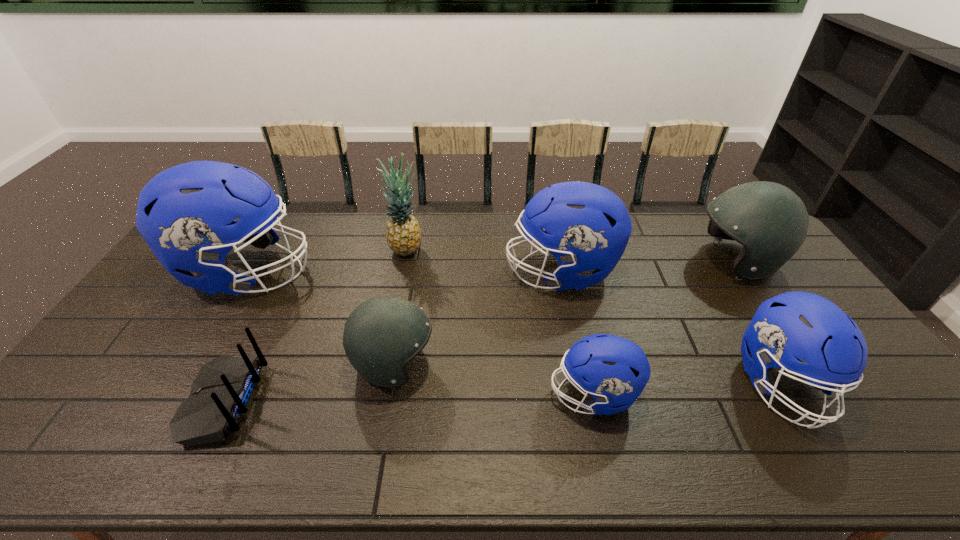
The image size is (960, 540). I want to click on vacant space situated 0.210m at the face opening of the smaller green football helmet, so coord(513,363).

The height and width of the screenshot is (540, 960). Find the location of `vacant space located 0.120m on the front-facing side of the smallest blue football helmet`. vacant space located 0.120m on the front-facing side of the smallest blue football helmet is located at coordinates (502, 394).

Where is `vacant area situated 0.220m on the front-facing side of the smallest blue football helmet`? vacant area situated 0.220m on the front-facing side of the smallest blue football helmet is located at coordinates (463, 394).

The width and height of the screenshot is (960, 540). In order to click on vacant space positioned on the front-facing side of the smallest blue football helmet in this screenshot , I will do `click(450, 394)`.

This screenshot has height=540, width=960. I want to click on free space located 0.310m on the back of the router, so click(x=381, y=401).

The image size is (960, 540). What are the coordinates of `pineapple that is at the far edge` in the screenshot? It's located at coord(403,234).

What are the coordinates of `football helmet present at the near edge` in the screenshot? It's located at (795, 325).

Find the location of a particular element. The height and width of the screenshot is (540, 960). router that is at the near edge is located at coordinates (221, 394).

At what (x,y) coordinates should I click in order to perform the action: click on object present at the left edge. Please return your answer as a coordinate pair (x, y). This screenshot has height=540, width=960. Looking at the image, I should click on (185, 214).

Locate an element on the screen. object positioned at the far left corner is located at coordinates (185, 214).